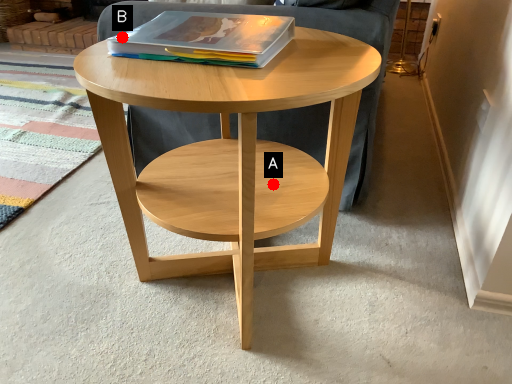
Question: Two points are circled on the image, labeled by A and B beside each circle. Which point appears farthest from the camera in this image?

Choices:
 (A) A is further
 (B) B is further

Answer: (A)